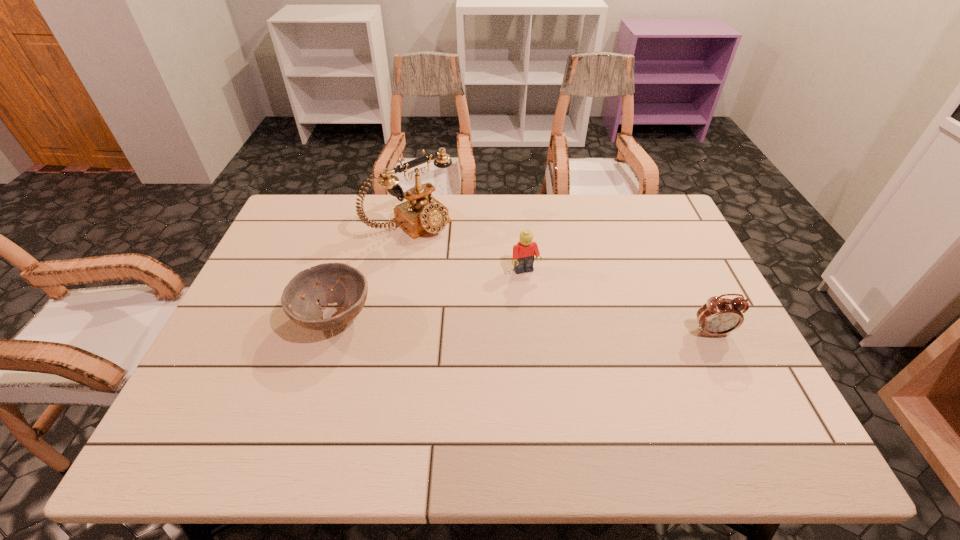
Image resolution: width=960 pixels, height=540 pixels. I want to click on vacant area that lies between the tallest object and the Lego, so click(x=468, y=248).

Locate an element on the screen. The height and width of the screenshot is (540, 960). blank region between the shortest object and the second object from right to left is located at coordinates (430, 294).

This screenshot has height=540, width=960. In order to click on object that is the third closest one to the shortest object in this screenshot , I will do `click(718, 316)`.

Locate an element on the screen. the second closest object relative to the rightmost object is located at coordinates (421, 214).

Identify the location of blank space that satisfies the following two spatial constraints: 1. on the front side of the Lego; 2. on the left side of the farthest object. The height and width of the screenshot is (540, 960). (403, 272).

You are a GUI agent. You are given a task and a screenshot of the screen. Output one action in this format:
    pyautogui.click(x=<x>, y=<y>)
    Task: Click on the free space that satisfies the following two spatial constraints: 1. on the back side of the tallest object; 2. on the right side of the bowl
    This screenshot has height=540, width=960.
    Given the screenshot: What is the action you would take?
    pyautogui.click(x=363, y=224)